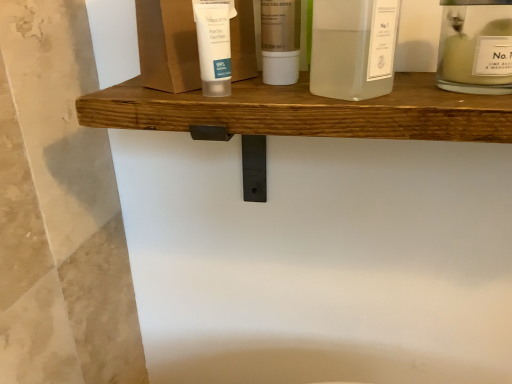
What are the coordinates of `vacant area located to the right-hand side of white matte tube at center, the first toiletry positioned from the left` in the screenshot? It's located at (365, 108).